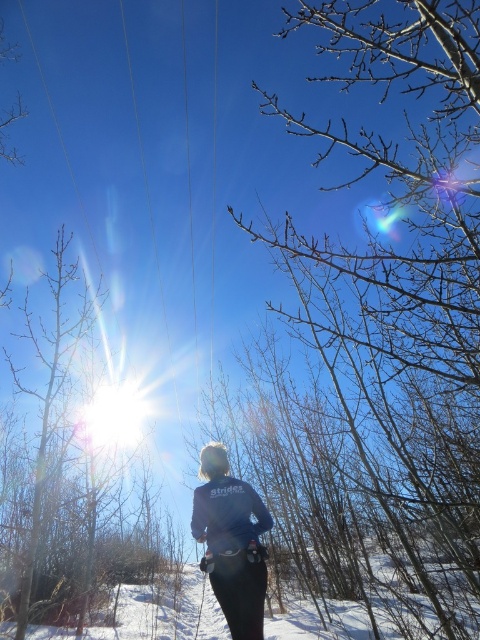
You are standing in the winter scene and want to take a photo of the bare branches at center without the sun in the frame. Based on their positions, can you determine if the branches will block the sun?

The bare branches at center are located at point (406,266), which is likely in the lower part of the frame. Since the sun is positioned low in the frame, the branches may block the sun if aligned correctly. However, without exact coordinates, it depends on their exact positioning relative to the sun.

You are trying to take a photo of the dark blue fleece jacket at center without the bare branches at center blocking it. Based on their sizes, is it possible to frame the shot so the jacket is fully visible without the branches covering it?

The bare branches at center are wider than the dark blue fleece jacket at center. Therefore, if the branches are positioned in front of the jacket, they might block parts of it. However, if you adjust your camera angle to position the jacket away from the branches or zoom in to reduce the branches in the frame, you could capture the jacket without obstruction.

You are a photographer trying to capture the scene with a camera placed at the camera position. You notice two points in the image labeled as point [362,131] and point [261,554]. Which point is closer to your camera?

Point [362,131] is further to the camera than point [261,554], so the point closer to the camera is point [261,554].